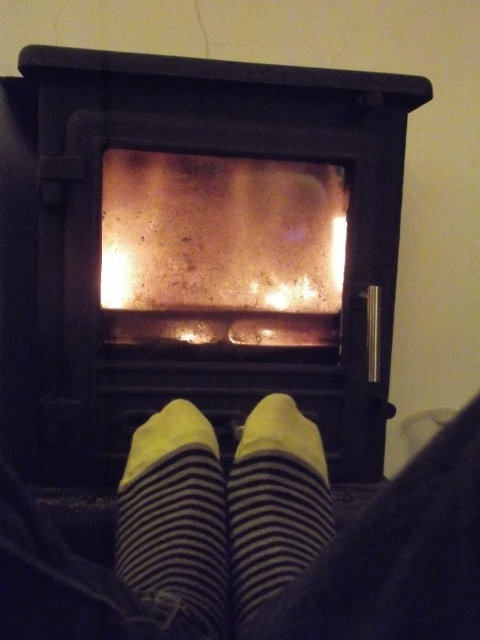
Question: Which of the following is the farthest from the observer?

Choices:
 (A) yellow striped sock at center
 (B) black matte fireplace at center

Answer: (B)

Question: Which of the following is the closest to the observer?

Choices:
 (A) (320, 440)
 (B) (358, 467)
 (C) (210, 564)

Answer: (C)

Question: In this image, where is yellow striped sock at center located relative to striped cotton sock at center?

Choices:
 (A) below
 (B) above

Answer: (A)

Question: Does black matte fireplace at center appear over yellow striped sock at center?

Choices:
 (A) yes
 (B) no

Answer: (A)

Question: Among these points, which one is farthest from the camera?

Choices:
 (A) (217, 476)
 (B) (284, 541)
 (C) (86, 161)

Answer: (C)

Question: Is black matte fireplace at center smaller than striped cotton sock at center?

Choices:
 (A) yes
 (B) no

Answer: (B)